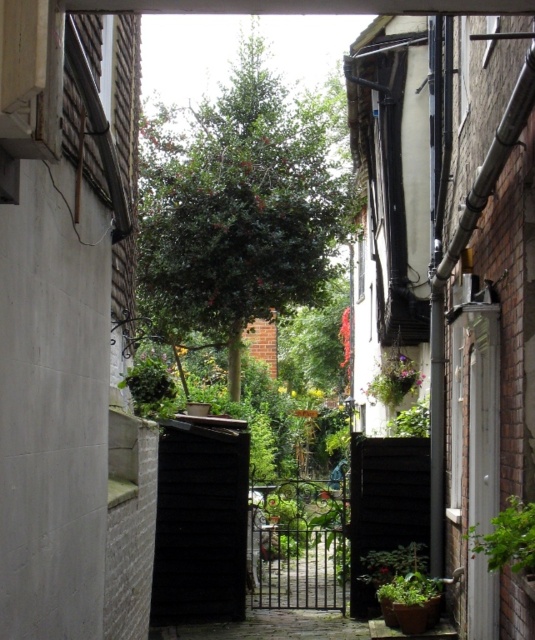
Question: Which of the following is the closest to the observer?

Choices:
 (A) (400, 364)
 (B) (428, 417)
 (C) (508, 547)

Answer: (C)

Question: Which object appears closest to the camera in this image?

Choices:
 (A) pink fabric hanging at center
 (B) green leafy plant at center

Answer: (B)

Question: Does green leafy plant at right come behind green matte plant at center?

Choices:
 (A) yes
 (B) no

Answer: (B)

Question: Does green matte plant at center have a greater width compared to pink fabric hanging at center?

Choices:
 (A) no
 (B) yes

Answer: (B)

Question: Considering the relative positions of green leafy plant at right and green leafy plant at center in the image provided, where is green leafy plant at right located with respect to green leafy plant at center?

Choices:
 (A) right
 (B) left

Answer: (B)

Question: Which point is farther to the camera?

Choices:
 (A) green leafy plant at right
 (B) green matte plant at center
 (C) green leafy plant at center
 (D) green matte plant at lower right

Answer: (C)